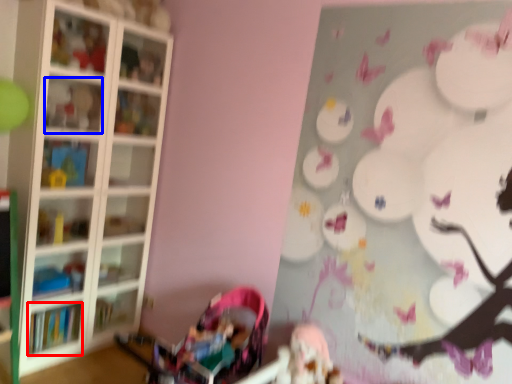
Question: Which of the following is the closest to the observer, book (highlighted by a red box) or shelf (highlighted by a blue box)?

Choices:
 (A) book
 (B) shelf

Answer: (B)